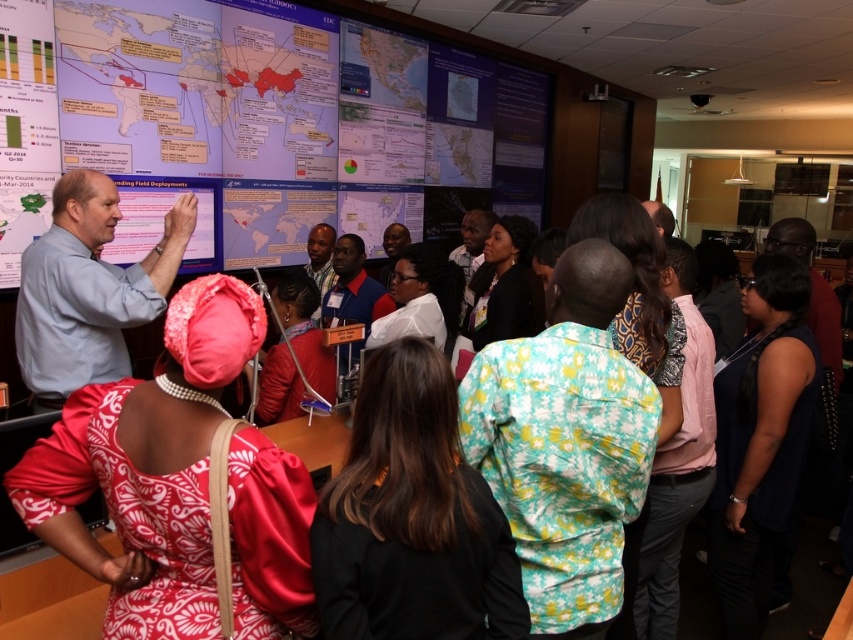
Can you confirm if matte white board at upper left is smaller than silky red dress at center?

No.

Is matte white board at upper left to the left of silky red dress at center from the viewer's perspective?

Incorrect, matte white board at upper left is not on the left side of silky red dress at center.

Is point (222, 164) less distant than point (171, 371)?

No, it is behind (171, 371).

Locate an element on the screen. This screenshot has width=853, height=640. matte white board at upper left is located at coordinates (253, 122).